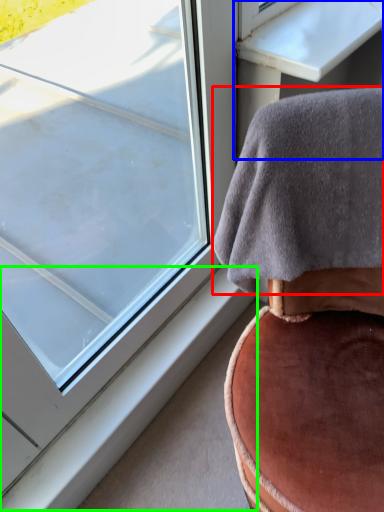
Question: Considering the real-world distances, which object is farthest from blanket (highlighted by a red box)? table (highlighted by a blue box) or window sill (highlighted by a green box)?

Choices:
 (A) table
 (B) window sill

Answer: (B)